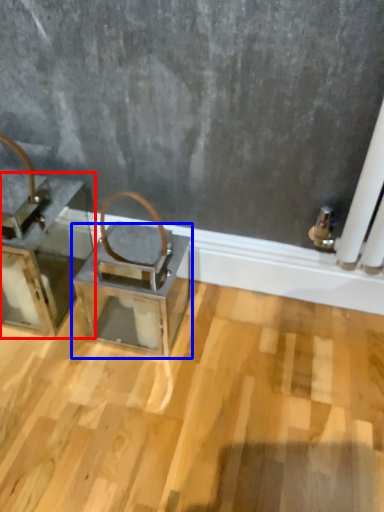
Question: Which of the following is the farthest to the observer, furniture (highlighted by a red box) or table (highlighted by a blue box)?

Choices:
 (A) furniture
 (B) table

Answer: (B)